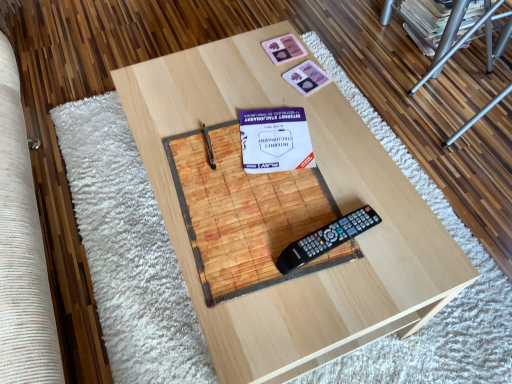
Find the location of a particular element. This screenshot has height=384, width=512. free location in front of metallic silver ladder at upper right is located at coordinates (470, 192).